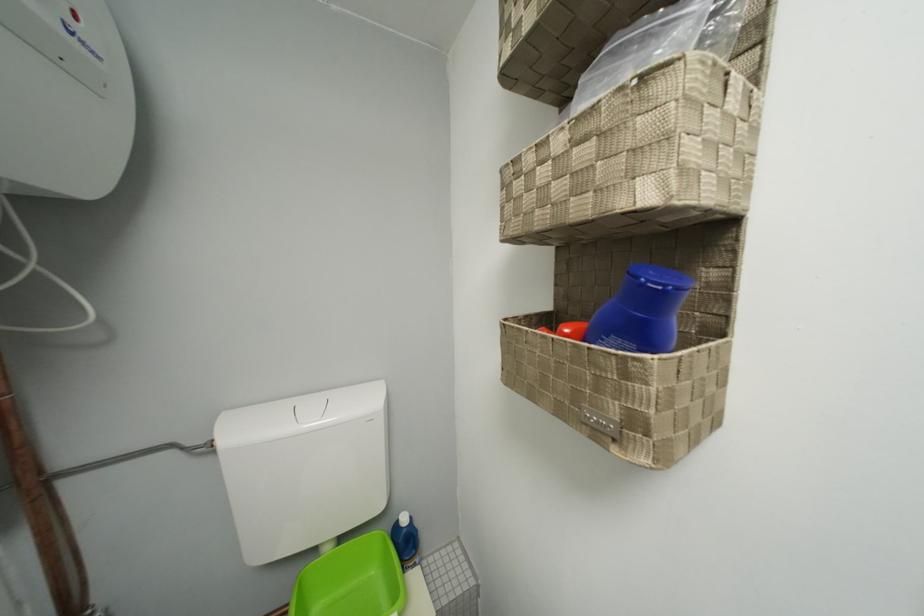
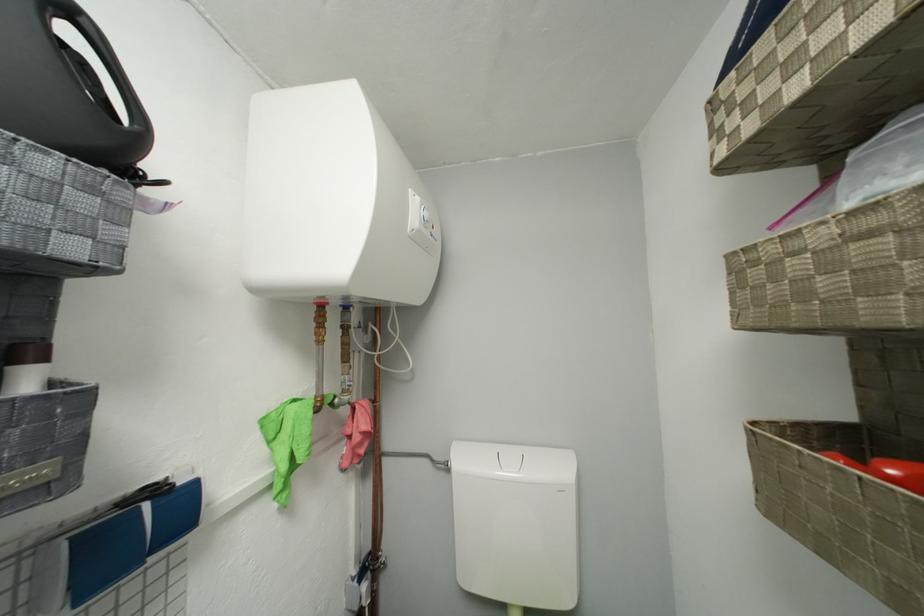
The point at (576, 333) is marked in the first image. Where is the corresponding point in the second image?

(903, 475)